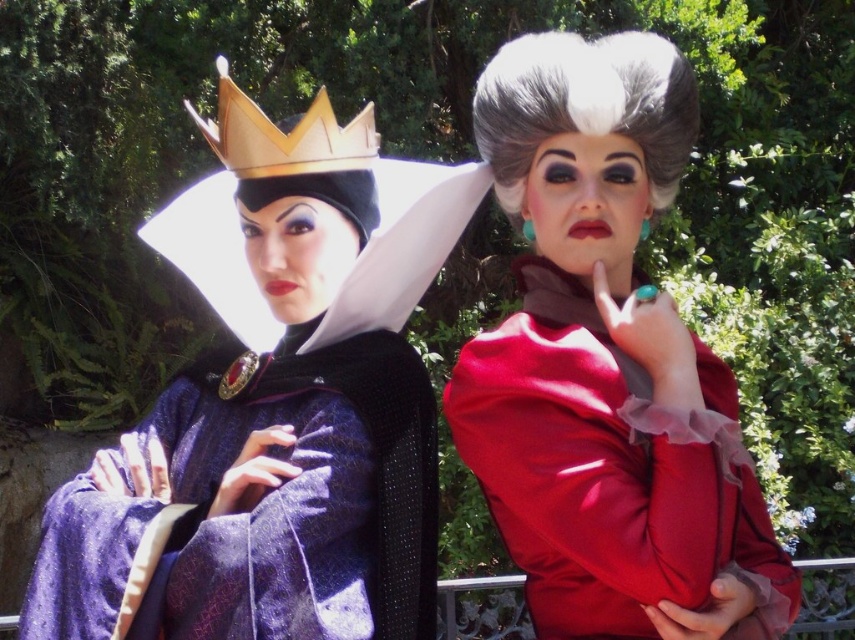
Between satin red dress at center and white fluffy wig at upper center, which one is positioned higher?

Positioned higher is white fluffy wig at upper center.

The height and width of the screenshot is (640, 855). Describe the element at coordinates (606, 365) in the screenshot. I see `satin red dress at center` at that location.

You are a GUI agent. You are given a task and a screenshot of the screen. Output one action in this format:
    pyautogui.click(x=<x>, y=<y>)
    Task: Click on the satin red dress at center
    
    Given the screenshot: What is the action you would take?
    pyautogui.click(x=606, y=365)

Can you confirm if satin red dress at center is positioned to the left of gold metallic crown at upper left?

Incorrect, satin red dress at center is not on the left side of gold metallic crown at upper left.

In the scene shown: Is satin red dress at center above gold metallic crown at upper left?

No, satin red dress at center is not above gold metallic crown at upper left.

Does point (482, 90) come in front of point (269, 128)?

No.

Locate an element on the screen. satin red dress at center is located at coordinates (606, 365).

The height and width of the screenshot is (640, 855). What do you see at coordinates (585, 106) in the screenshot?
I see `white fluffy wig at upper center` at bounding box center [585, 106].

Does point (668, 125) lie behind point (211, 131)?

No, it is not.

Where is `white fluffy wig at upper center`? white fluffy wig at upper center is located at coordinates (585, 106).